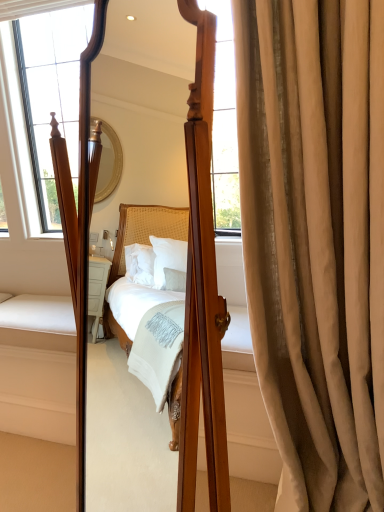
Question: Does point (200, 309) appear closer or farther from the camera than point (312, 431)?

Choices:
 (A) closer
 (B) farther

Answer: (A)

Question: Based on their positions, is wooden mirror at center located to the left or right of satin beige curtain at right?

Choices:
 (A) left
 (B) right

Answer: (A)

Question: Is wooden mirror at center bigger or smaller than satin beige curtain at right?

Choices:
 (A) small
 (B) big

Answer: (B)

Question: Considering the positions of satin beige curtain at right and wooden mirror at center in the image, is satin beige curtain at right bigger or smaller than wooden mirror at center?

Choices:
 (A) small
 (B) big

Answer: (A)

Question: From a real-world perspective, relative to wooden mirror at center, is satin beige curtain at right vertically above or below?

Choices:
 (A) below
 (B) above

Answer: (A)

Question: Would you say satin beige curtain at right is to the left or to the right of wooden mirror at center in the picture?

Choices:
 (A) right
 (B) left

Answer: (A)

Question: Considering the positions of satin beige curtain at right and wooden mirror at center in the image, is satin beige curtain at right taller or shorter than wooden mirror at center?

Choices:
 (A) short
 (B) tall

Answer: (B)